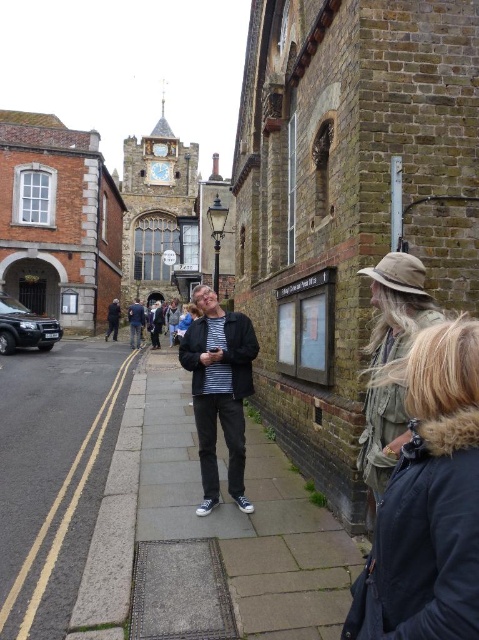
You are a photographer trying to capture a shot of both the dark blue jacket at center and the striped shirt at center. Since you want them both in the frame, can you tell me which one is on the left side so you can position your camera accordingly?

The dark blue jacket at center is positioned on the left side of striped shirt at center, so you should position your camera to include both by focusing on the left side first.

You are a tourist standing on the gray concrete sidewalk at lower left and want to take a photo of the striped shirt at center. Which direction should you move to get a better shot?

The striped shirt at center is to the left of the gray concrete sidewalk at lower left. To take a photo of the striped shirt at center, you should move to the left side of the gray concrete sidewalk at lower left.